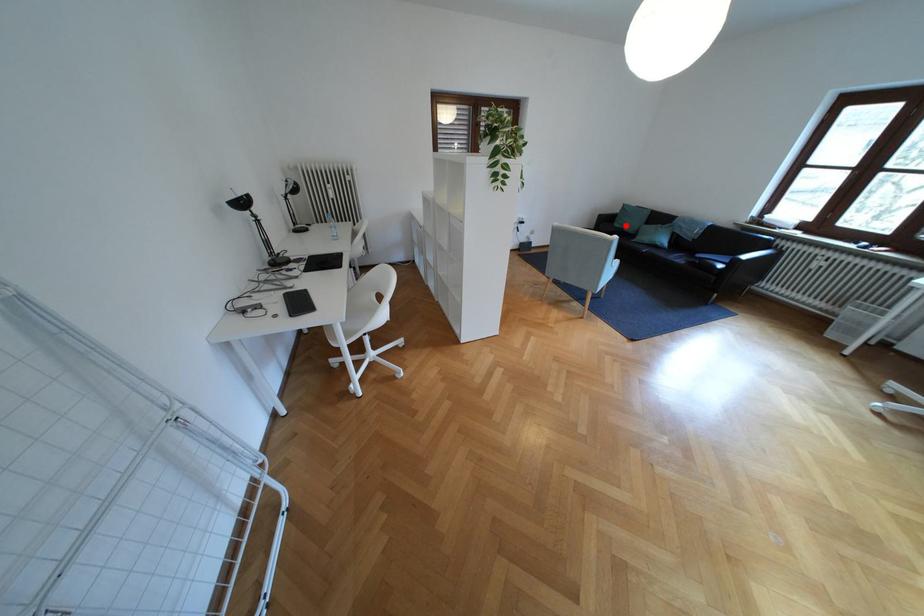
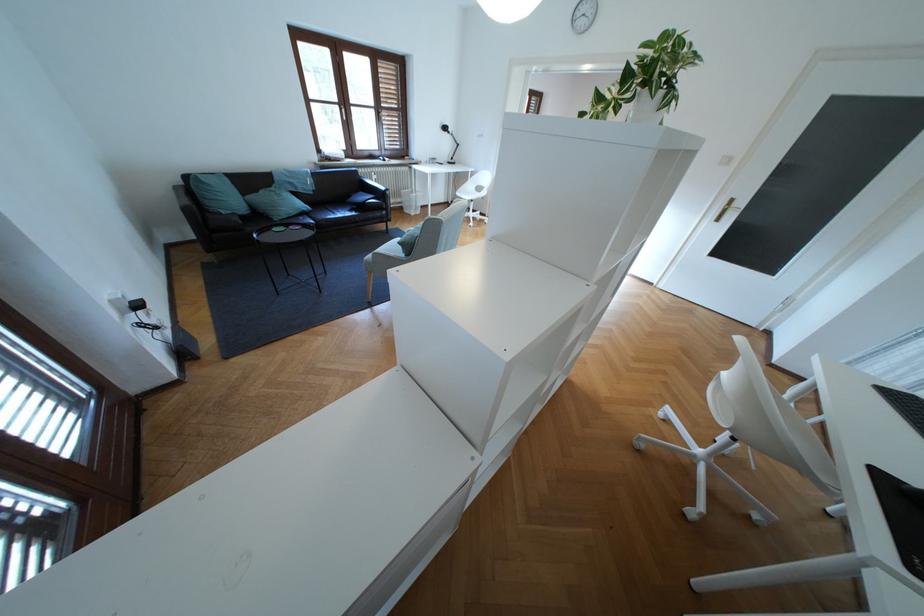
Find the pixel in the second image that matches the highlighted location in the first image.

(234, 213)